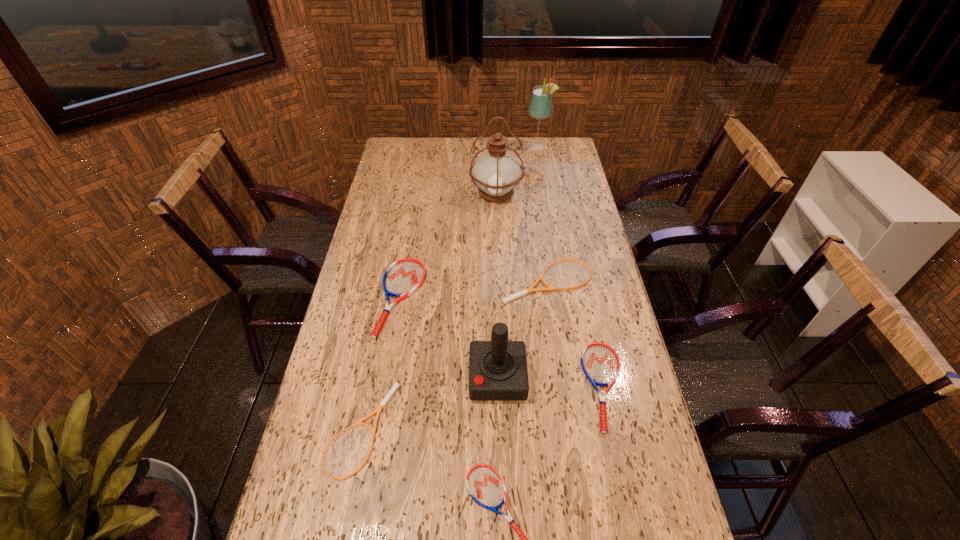
Locate an element on the screen. alcohol is located at coordinates (540, 105).

Find the location of a particular element. The image size is (960, 540). oil lamp is located at coordinates (496, 172).

The height and width of the screenshot is (540, 960). Identify the location of red joystick. (498, 371).

I want to click on joystick, so click(x=498, y=371).

Locate an element on the screen. The height and width of the screenshot is (540, 960). the biggest blue tennis racket is located at coordinates (402, 278).

Find the location of a particular element. the leftmost blue tennis racket is located at coordinates point(402,278).

This screenshot has height=540, width=960. I want to click on the farther beige tennis racket, so click(550, 288).

Find the location of a particular element. the right beige tennis racket is located at coordinates (550, 288).

Where is `the second biggest blue tennis racket`? the second biggest blue tennis racket is located at coordinates (600, 363).

I want to click on the rightmost blue tennis racket, so 600,363.